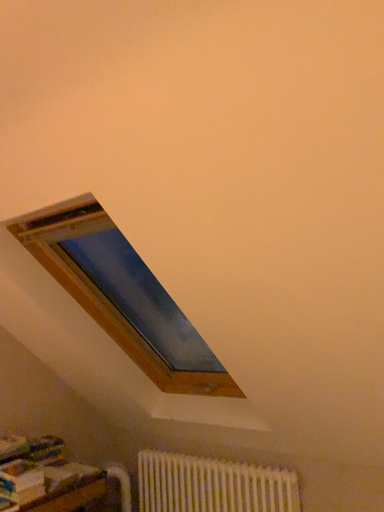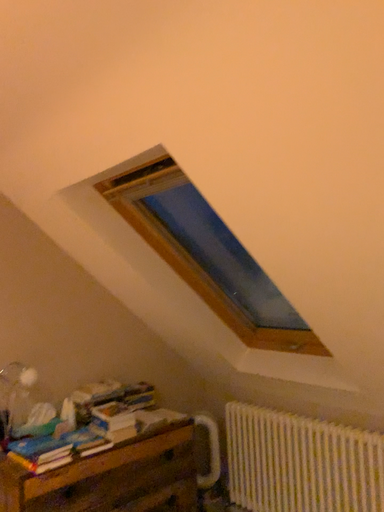
Question: How did the camera likely rotate when shooting the video?

Choices:
 (A) rotated left
 (B) rotated right

Answer: (A)